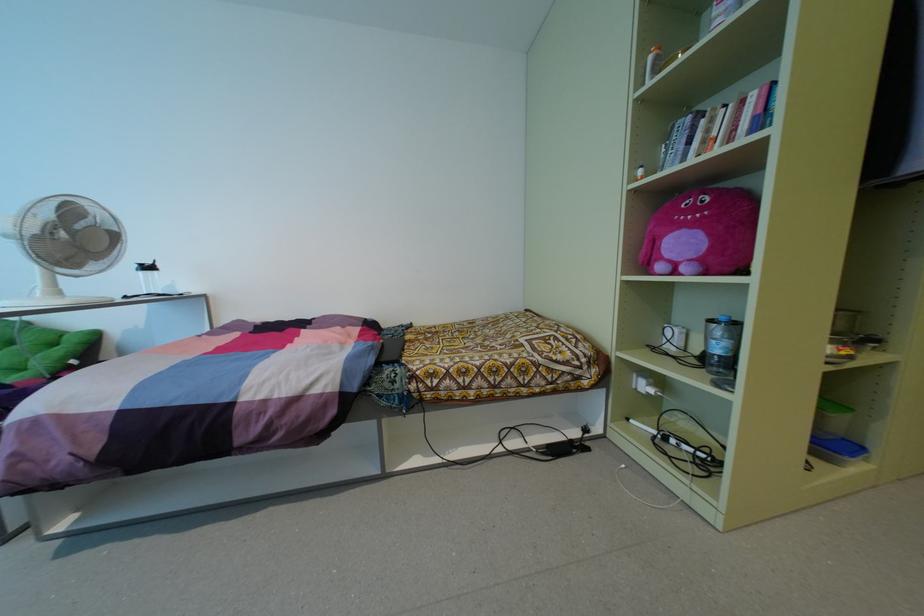
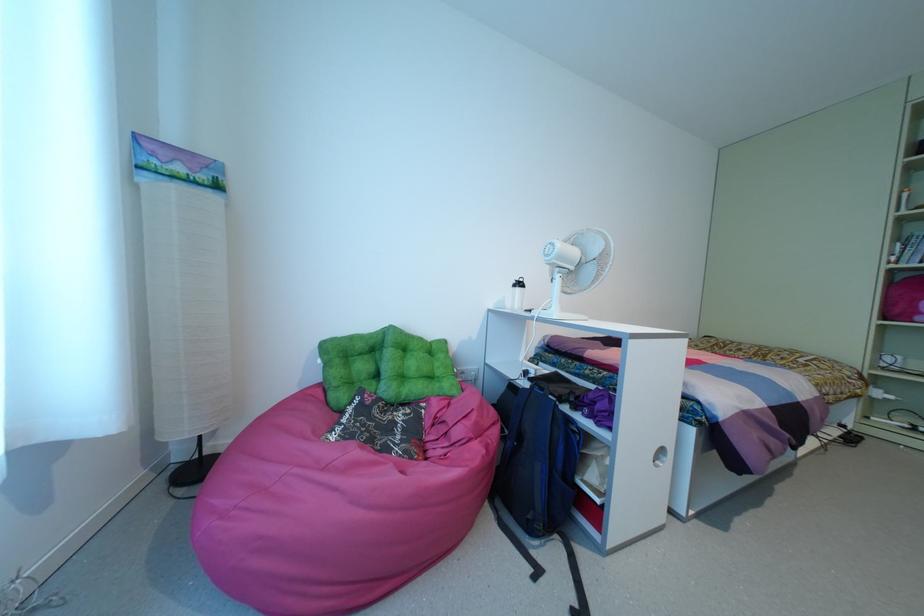
Question: What movement of the cameraman would produce the second image?

Choices:
 (A) Left
 (B) Right
 (C) Forward
 (D) Backward

Answer: (A)